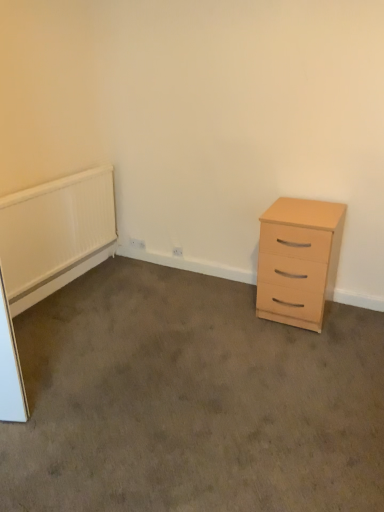
The height and width of the screenshot is (512, 384). Identify the location of space that is in front of light wood/finish chest of drawers at right. (309, 348).